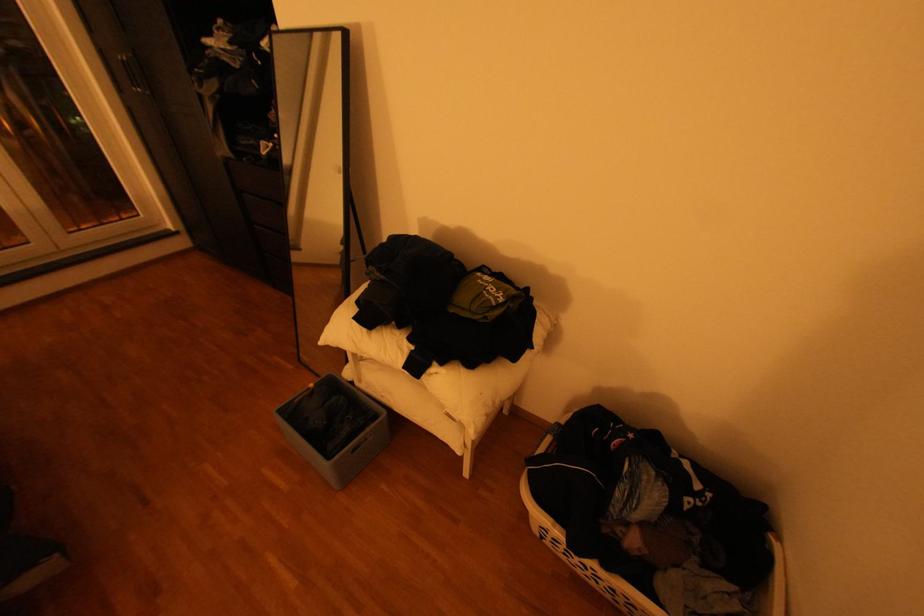
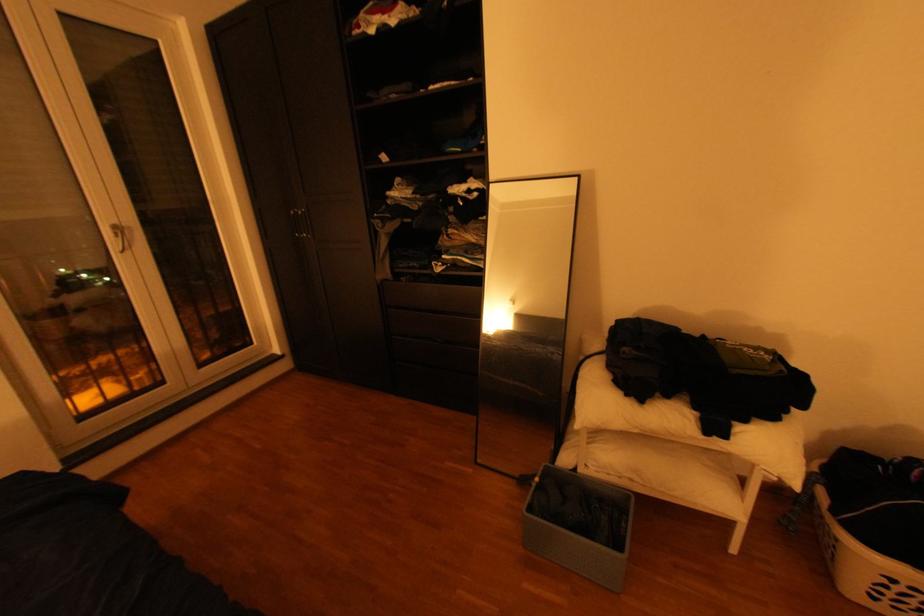
Locate, in the second image, the point that corresponds to pixel 561 435 in the first image.

(830, 484)